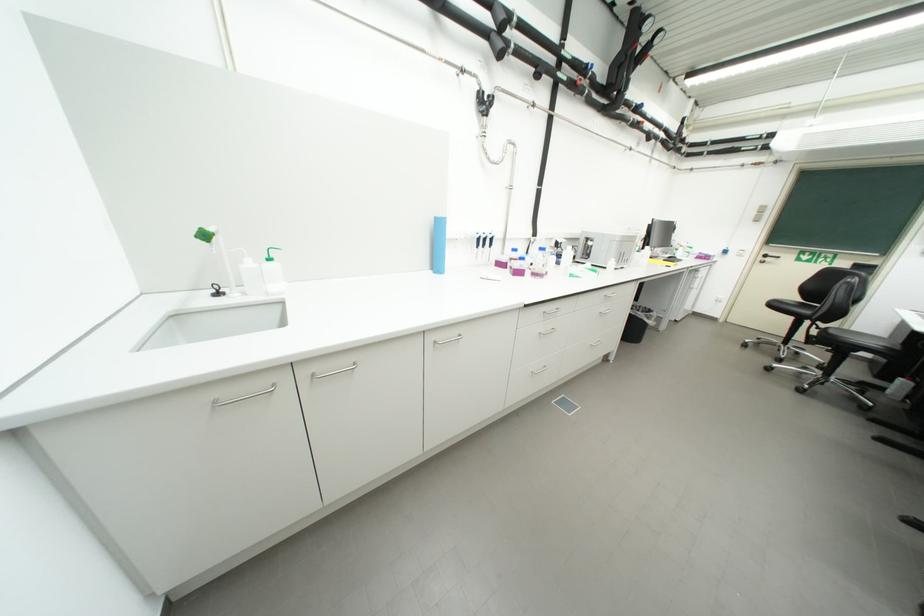
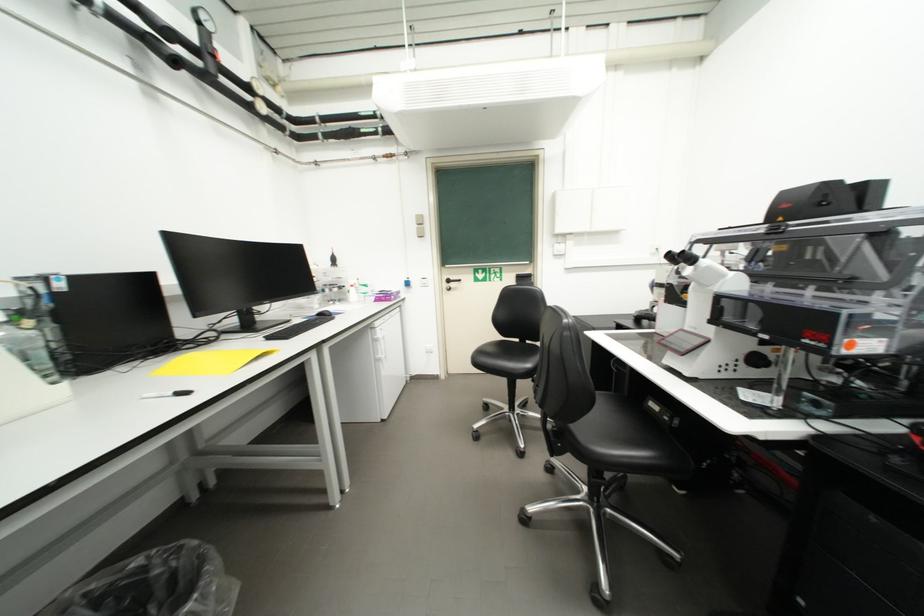
Where in the second image is the point corresponding to the point at 783,307 from the first image?

(490, 362)